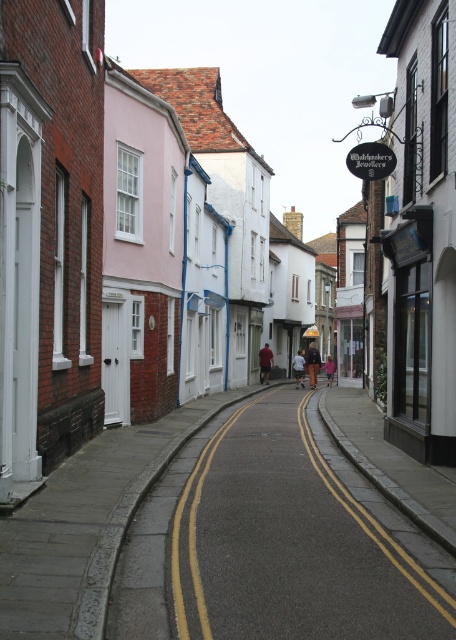
Question: Which object is positioned closest to the pink fabric at center?

Choices:
 (A) dark brown leather jacket at center
 (B) smooth asphalt road at center
 (C) dark blue jeans at center
 (D) dark red fabric at center

Answer: (C)

Question: Which object is farther from the camera taking this photo?

Choices:
 (A) smooth asphalt road at center
 (B) dark blue jeans at center
 (C) pink fabric at center
 (D) dark brown leather jacket at center

Answer: (C)

Question: Can you confirm if smooth asphalt road at center is wider than dark brown leather jacket at center?

Choices:
 (A) no
 (B) yes

Answer: (B)

Question: Is dark red fabric at center thinner than pink fabric at center?

Choices:
 (A) yes
 (B) no

Answer: (A)

Question: Can you confirm if dark blue jeans at center is positioned above pink fabric at center?

Choices:
 (A) yes
 (B) no

Answer: (A)

Question: Considering the real-world distances, which object is farthest from the dark brown leather jacket at center?

Choices:
 (A) pink fabric at center
 (B) dark red fabric at center
 (C) dark blue jeans at center
 (D) smooth asphalt road at center

Answer: (D)